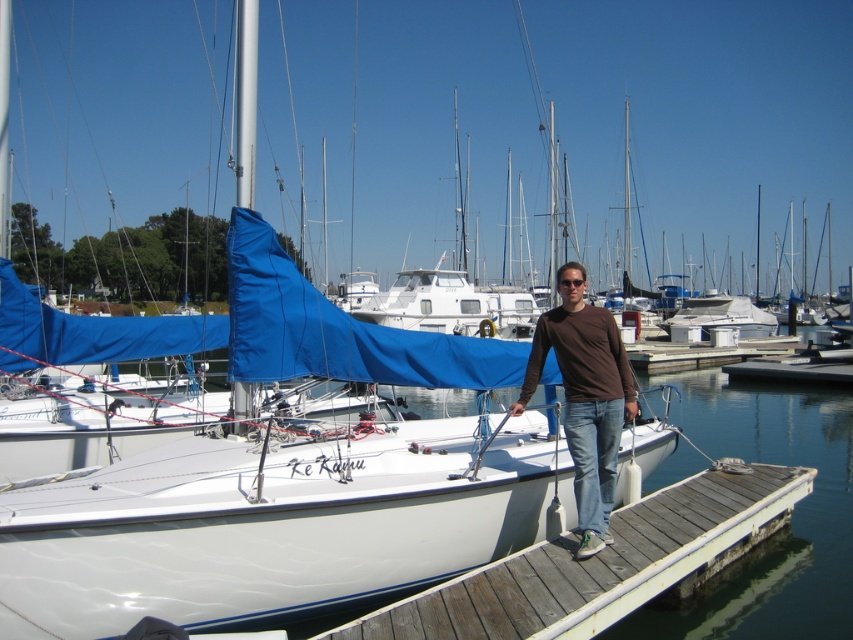
You are standing on the wooden dock at center and want to reach the wooden at center. Which direction should you move to get there?

The wooden at center is positioned above the wooden dock at center, so you should move upward to reach it.

You are standing on the wooden dock and looking at the brown cotton shirt at center and the wooden at center. Which object is higher in the scene?

The brown cotton shirt at center is higher than wooden at center because it is located above it.